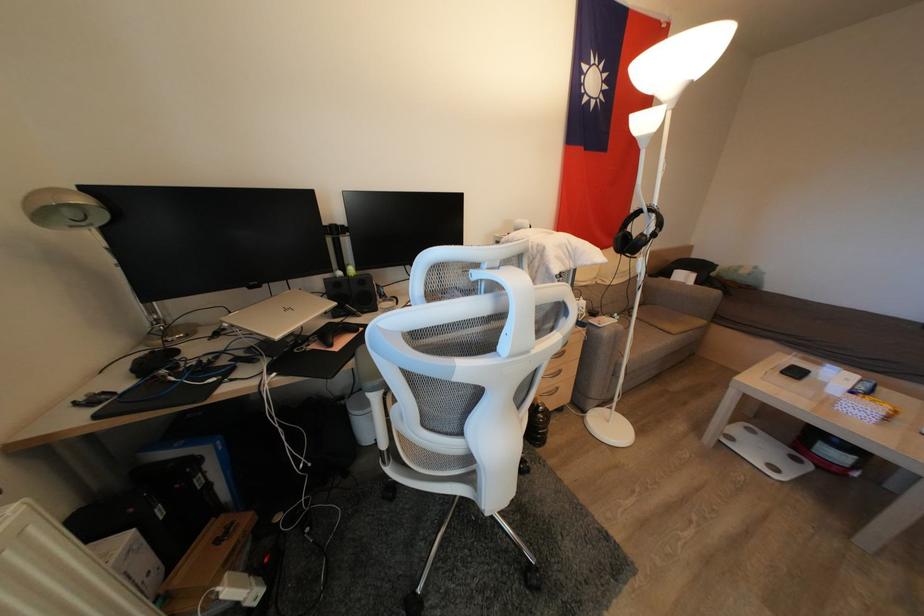
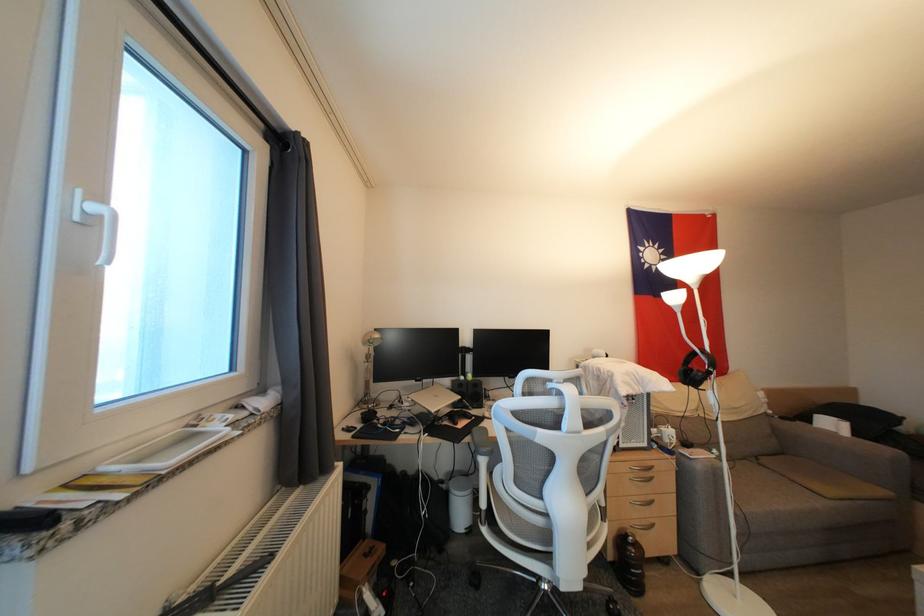
Locate, in the second image, the point that corresponds to the point at 719,297 in the first image.

(893, 456)